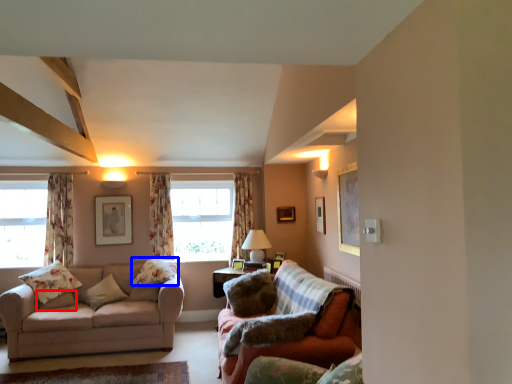
Question: Which object appears farthest to the camera in this image, pillow (highlighted by a red box) or pillow (highlighted by a blue box)?

Choices:
 (A) pillow
 (B) pillow

Answer: (B)